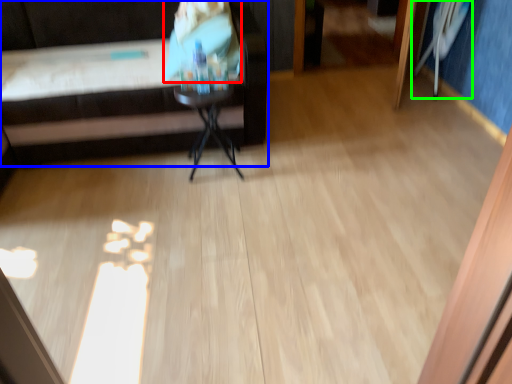
Question: Estimate the real-world distances between objects in this image. Which object is closer to person (highlighted by a red box), furniture (highlighted by a blue box) or swivel chair (highlighted by a green box)?

Choices:
 (A) furniture
 (B) swivel chair

Answer: (A)